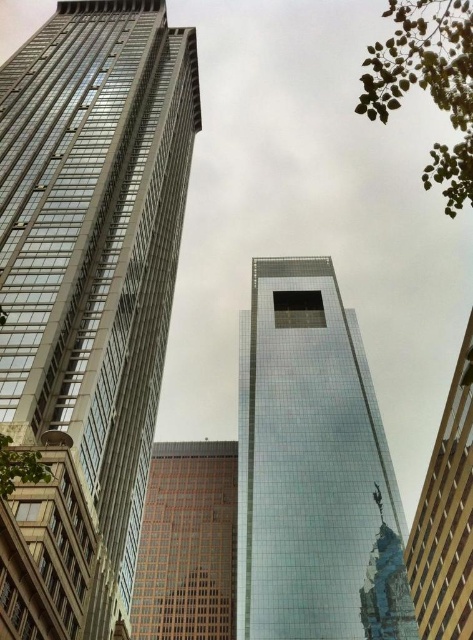
Question: Does glassy steel tower at center lie behind matte glass skyscraper at right?

Choices:
 (A) no
 (B) yes

Answer: (B)

Question: Which point is closer to the camera taking this photo?

Choices:
 (A) (377, 440)
 (B) (27, 65)
 (C) (430, 592)

Answer: (C)

Question: Which of the following is the closest to the observer?

Choices:
 (A) (173, 148)
 (B) (134, 621)

Answer: (A)

Question: Does glassy steel skyscraper at center have a smaller size compared to brown brick building at center?

Choices:
 (A) yes
 (B) no

Answer: (B)

Question: Which point is closer to the camera?

Choices:
 (A) brown brick building at center
 (B) glassy steel skyscraper at center

Answer: (B)

Question: Is glassy steel skyscraper at center wider than matte glass skyscraper at right?

Choices:
 (A) no
 (B) yes

Answer: (B)